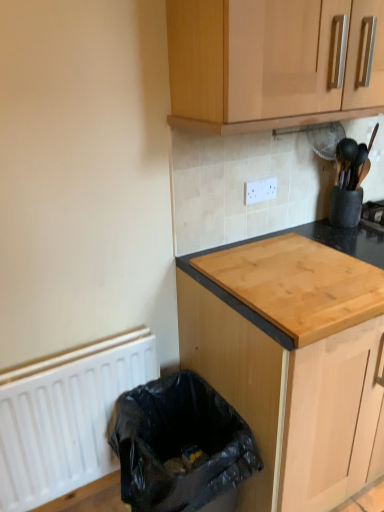
Locate an element on the screen. This screenshot has height=512, width=384. empty space that is ontop of natural wood cutting board at center, which appears as the 2th cabinetry when viewed from the top is located at coordinates (302, 271).